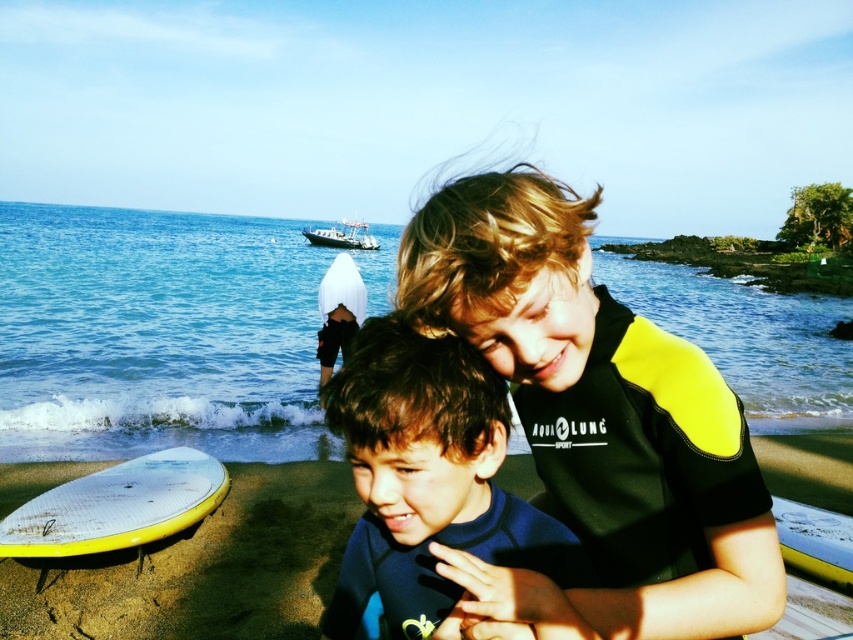
You are a photographer trying to capture a wide shot of the blue water at center and the white plastic boat at upper center. Since you want both objects to be clearly visible in the frame, which object should you prioritize positioning closer to the camera to ensure it doesn not get cut off?

The white plastic boat at upper center should be positioned closer to the camera because it is narrower than the blue water at center, making it easier to fit within the frame without being cut off.

Consider the image. You are a photographer trying to capture a photo of the blue water at center and the white plastic boat at upper center. Which object should you focus on if you want to include both in the frame without cropping?

The blue water at center has a larger size compared to the white plastic boat at upper center, so you should focus on the blue water at center to ensure both fit in the frame.

You are standing at the point labeled as point (x=221, y=250). You want to walk to the nearest beach exit, which is located 50 meters away from your current position. Can you reach the exit without exceeding the 50 meter limit?

Yes, since the distance between you and the nearest beach exit is 43.95 meters, which is within the 50 meter limit.